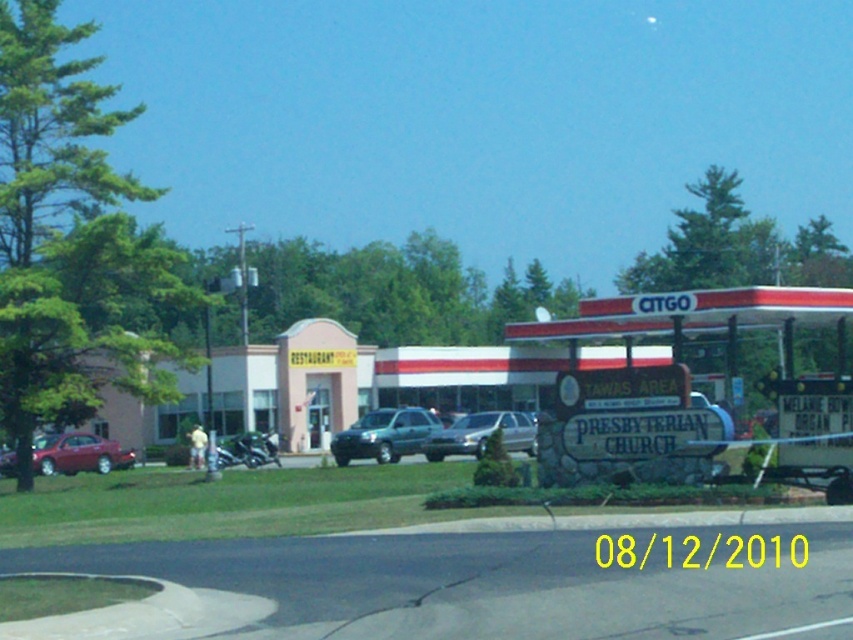
You are a customer arriving at the gas station and need to park your car. You see a shiny red sedan at left and a satin silver sedan at center. Which car is closer to the entrance of the gas station?

The shiny red sedan at left is closer to the entrance of the gas station because it is further to the viewer than the satin silver sedan at center, meaning it is positioned nearer to the entrance area.

You are a delivery person who needs to park your delivery van, which is 2 meters tall, in the parking lot. The parking spot is between the shiny red sedan at left and the metallic silver motorcycle at center. Can your van fit vertically in that space?

The shiny red sedan at left has a lesser height compared to metallic silver motorcycle at center. Since the van is 2 meters tall, the space between them may not be sufficient if the motorcycle is taller than the van. However, since the motorcycle is taller than the sedan but its exact height isn